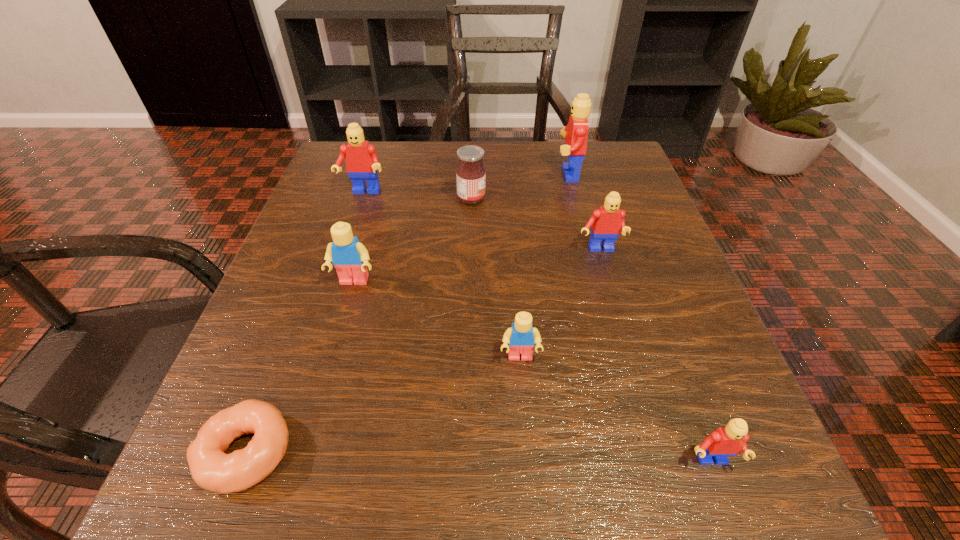
The width and height of the screenshot is (960, 540). Find the location of `object that is at the far right corner`. object that is at the far right corner is located at coordinates (575, 133).

At what (x,y) coordinates should I click in order to perform the action: click on object located at the near right corner. Please return your answer as a coordinate pair (x, y). The height and width of the screenshot is (540, 960). Looking at the image, I should click on (730, 440).

The image size is (960, 540). In the image, there is a desktop. Identify the location of free region at the far edge. (557, 190).

The image size is (960, 540). Identify the location of vacant space at the near edge. (468, 468).

Find the location of a particular element. The height and width of the screenshot is (540, 960). free region at the left edge of the desktop is located at coordinates (338, 370).

Locate an element on the screen. The image size is (960, 540). free space at the right edge is located at coordinates (629, 256).

Image resolution: width=960 pixels, height=540 pixels. Find the location of `vacant space at the far left corner`. vacant space at the far left corner is located at coordinates (385, 142).

Where is `vacant area between the second nearest red Lego and the bigger yellow Lego`? The height and width of the screenshot is (540, 960). vacant area between the second nearest red Lego and the bigger yellow Lego is located at coordinates (476, 266).

Where is `free space between the nearest Lego and the third nearest Lego`? The width and height of the screenshot is (960, 540). free space between the nearest Lego and the third nearest Lego is located at coordinates (532, 372).

Find the location of `vacant space that's between the left yellow Lego and the tallest object`. vacant space that's between the left yellow Lego and the tallest object is located at coordinates (460, 227).